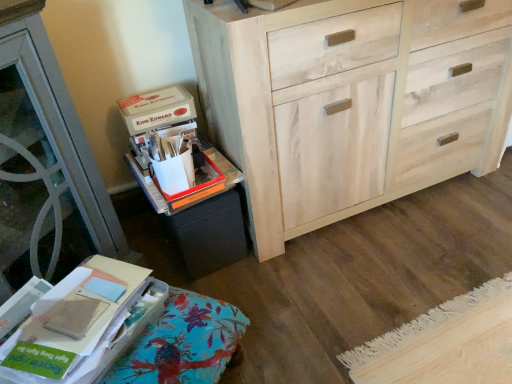
Describe the element at coordinates (349, 101) in the screenshot. I see `natural wood cabinet at center` at that location.

At what (x,y) coordinates should I click in order to perform the action: click on natural wood cabinet at center. Please return your answer as a coordinate pair (x, y). The image size is (512, 384). Looking at the image, I should click on (349, 101).

This screenshot has width=512, height=384. I want to click on matte cardboard book at lower left, so click(79, 324).

What's the angular difference between matte cardboard box at upper left and matte cardboard book at lower left's facing directions?

There is a 34.9-degree angle between the facing directions of matte cardboard box at upper left and matte cardboard book at lower left.

Based on the photo, do you think matte cardboard box at upper left is within matte cardboard book at lower left, or outside of it?

matte cardboard box at upper left is not inside matte cardboard book at lower left, it's outside.

From a real-world perspective, is matte cardboard box at upper left positioned above or below matte cardboard book at lower left?

matte cardboard box at upper left is situated higher than matte cardboard book at lower left in the real world.

Is matte cardboard box at upper left with matte cardboard book at lower left?

They are not placed beside each other.

Does matte cardboard box at upper left turn towards black matte storage bin at lower left?

No, matte cardboard box at upper left is not facing towards black matte storage bin at lower left.

Which of these two, matte cardboard box at upper left or black matte storage bin at lower left, stands shorter?

matte cardboard box at upper left.

Considering the points (155, 112) and (231, 252), which point is behind, point (155, 112) or point (231, 252)?

Point (231, 252)

Is matte cardboard box at upper left behind black matte storage bin at lower left?

That is True.

Who is smaller, natural wood cabinet at center or matte cardboard box at upper left?

matte cardboard box at upper left.

Considering the sizes of natural wood cabinet at center and matte cardboard box at upper left in the image, is natural wood cabinet at center taller or shorter than matte cardboard box at upper left?

Clearly, natural wood cabinet at center is taller compared to matte cardboard box at upper left.

Is natural wood cabinet at center facing towards matte cardboard box at upper left?

No, natural wood cabinet at center is not aimed at matte cardboard box at upper left.

Is natural wood cabinet at center positioned far away from matte cardboard box at upper left?

No.

Is matte cardboard book at lower left located outside natural wood cabinet at center?

matte cardboard book at lower left lies outside natural wood cabinet at center's area.

Is matte cardboard book at lower left wider than natural wood cabinet at center?

In fact, matte cardboard book at lower left might be narrower than natural wood cabinet at center.

Is matte cardboard book at lower left touching natural wood cabinet at center?

No, matte cardboard book at lower left is not beside natural wood cabinet at center.

Which is more to the right, matte cardboard book at lower left or natural wood cabinet at center?

Positioned to the right is natural wood cabinet at center.

From the image's perspective, who appears lower, black matte storage bin at lower left or natural wood cabinet at center?

black matte storage bin at lower left.

Is black matte storage bin at lower left not near natural wood cabinet at center?

black matte storage bin at lower left is near natural wood cabinet at center, not far away.

Does black matte storage bin at lower left have a greater width compared to natural wood cabinet at center?

Yes, black matte storage bin at lower left is wider than natural wood cabinet at center.

From their relative heights in the image, would you say black matte storage bin at lower left is taller or shorter than matte cardboard box at upper left?

Clearly, black matte storage bin at lower left is taller compared to matte cardboard box at upper left.

Which of these two, black matte storage bin at lower left or matte cardboard box at upper left, is thinner?

matte cardboard box at upper left.

Which object is further away from the camera taking this photo, black matte storage bin at lower left or matte cardboard box at upper left?

matte cardboard box at upper left.

From a real-world perspective, is matte cardboard book at lower left positioned under matte cardboard box at upper left based on gravity?

Yes.

Is matte cardboard book at lower left in front of or behind matte cardboard box at upper left in the image?

In the image, matte cardboard book at lower left appears in front of matte cardboard box at upper left.

Looking at this image, is matte cardboard book at lower left oriented towards matte cardboard box at upper left?

No.

Can you confirm if matte cardboard book at lower left is taller than matte cardboard box at upper left?

Correct, matte cardboard book at lower left is much taller as matte cardboard box at upper left.

Locate an element on the screen. This screenshot has width=512, height=384. paperback book that appears on the left of matte cardboard box at upper left is located at coordinates (79, 324).

Locate an element on the screen. The width and height of the screenshot is (512, 384). storage box above the black matte storage bin at lower left (from a real-world perspective) is located at coordinates [157, 109].

Looking at the image, which one is located closer to black matte storage bin at lower left, matte cardboard book at lower left or natural wood cabinet at center?

matte cardboard book at lower left is closer to black matte storage bin at lower left.

Based on their spatial positions, is natural wood cabinet at center or matte cardboard book at lower left further from matte cardboard box at upper left?

natural wood cabinet at center.

Estimate the real-world distances between objects in this image. Which object is closer to black matte storage bin at lower left, matte cardboard box at upper left or natural wood cabinet at center?

Based on the image, matte cardboard box at upper left appears to be nearer to black matte storage bin at lower left.

Which object lies nearer to the anchor point matte cardboard book at lower left, matte cardboard box at upper left or natural wood cabinet at center?

The object closer to matte cardboard book at lower left is matte cardboard box at upper left.

Based on the photo, from the image, which object appears to be farther from matte cardboard book at lower left, natural wood cabinet at center or black matte storage bin at lower left?

natural wood cabinet at center is positioned further to the anchor matte cardboard book at lower left.

Which object lies nearer to the anchor point natural wood cabinet at center, black matte storage bin at lower left or matte cardboard box at upper left?

The object closer to natural wood cabinet at center is black matte storage bin at lower left.

Based on their spatial positions, is natural wood cabinet at center or black matte storage bin at lower left closer to matte cardboard box at upper left?

black matte storage bin at lower left.

When comparing their distances from black matte storage bin at lower left, does natural wood cabinet at center or matte cardboard box at upper left seem further?

The object further to black matte storage bin at lower left is natural wood cabinet at center.

Where is `cabinetry between matte cardboard book at lower left and natural wood cabinet at center`? The height and width of the screenshot is (384, 512). cabinetry between matte cardboard book at lower left and natural wood cabinet at center is located at coordinates (203, 224).

Where is `storage box between matte cardboard book at lower left and natural wood cabinet at center from left to right`? The width and height of the screenshot is (512, 384). storage box between matte cardboard book at lower left and natural wood cabinet at center from left to right is located at coordinates (157, 109).

Identify the location of cabinetry between matte cardboard box at upper left and natural wood cabinet at center. This screenshot has height=384, width=512. (203, 224).

Identify the location of cabinetry between matte cardboard box at upper left and matte cardboard book at lower left in the up-down direction. (203, 224).